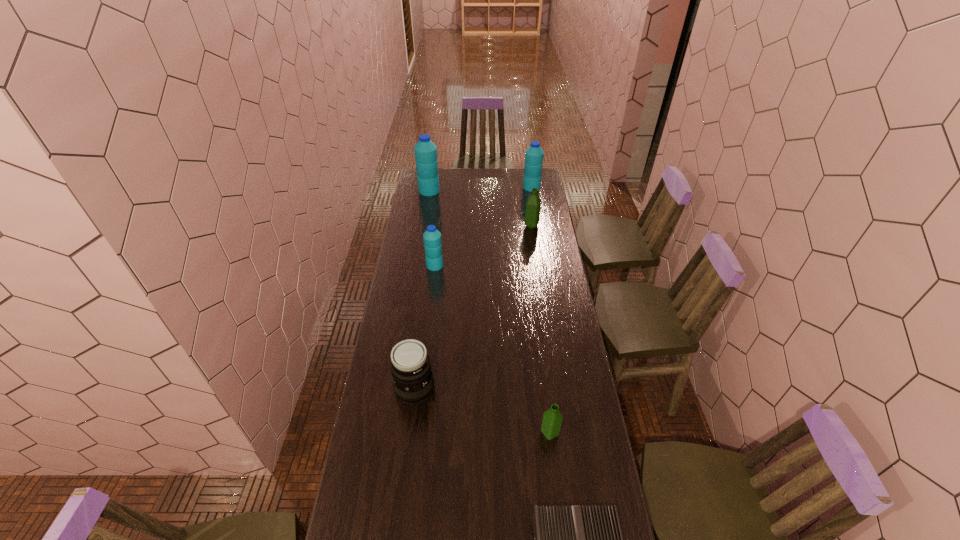
Find the location of `the tallest water bottle`. the tallest water bottle is located at coordinates (425, 150).

Find the location of a particular element. The height and width of the screenshot is (540, 960). the biggest blue water bottle is located at coordinates (425, 150).

Find the location of a particular element. the second smallest blue water bottle is located at coordinates (534, 154).

Where is `the second tallest water bottle`? the second tallest water bottle is located at coordinates (534, 154).

Identify the location of the farther green water bottle. (533, 205).

Locate an element on the screen. the third farthest water bottle is located at coordinates (533, 205).

Where is `the smallest blue water bottle`? the smallest blue water bottle is located at coordinates [432, 237].

Where is `the nearest blue water bottle`? The width and height of the screenshot is (960, 540). the nearest blue water bottle is located at coordinates (432, 237).

Locate an element on the screen. This screenshot has width=960, height=540. the fifth farthest object is located at coordinates (413, 382).

Where is `the nearest water bottle`? The image size is (960, 540). the nearest water bottle is located at coordinates (552, 419).